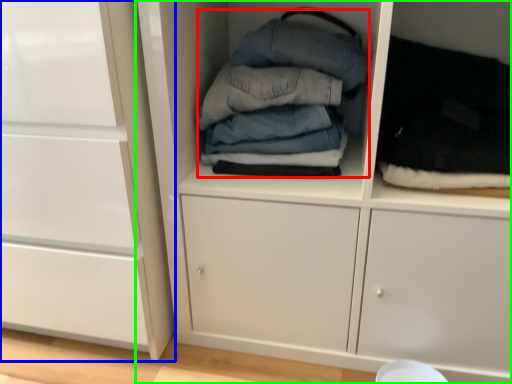
Question: Which is nearer to the clothing (highlighted by a red box)? cabinetry (highlighted by a blue box) or cupboard (highlighted by a green box).

Choices:
 (A) cabinetry
 (B) cupboard

Answer: (B)